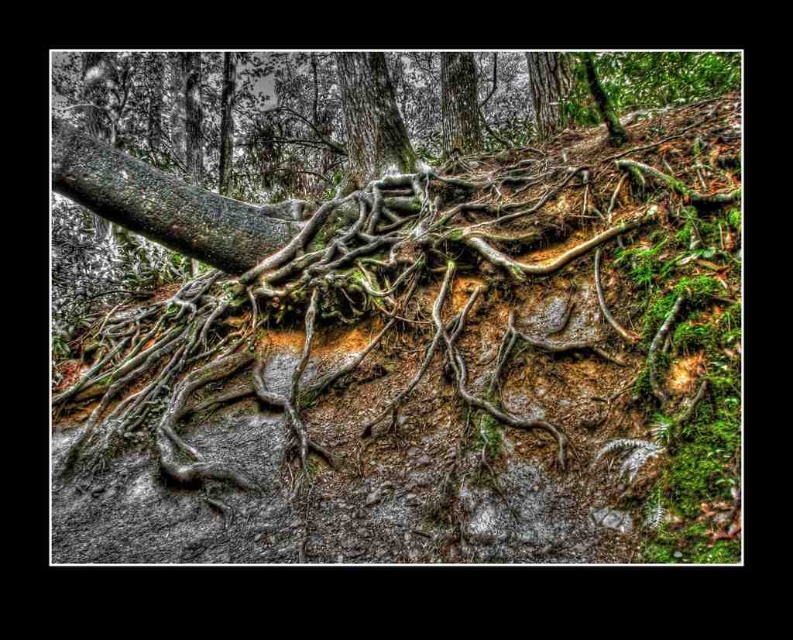
Between brown rough roots at center and smooth gray bark at center, which one is positioned lower?

brown rough roots at center is below.

At what (x,y) coordinates should I click in order to perform the action: click on brown rough roots at center. Please return your answer as a coordinate pair (x, y). Looking at the image, I should click on (437, 371).